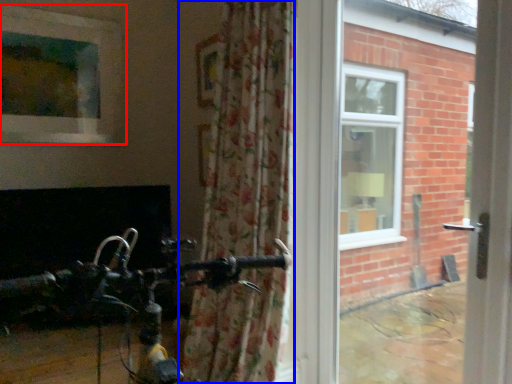
Question: Which of the following is the farthest to the observer, window (highlighted by a red box) or curtain (highlighted by a blue box)?

Choices:
 (A) window
 (B) curtain

Answer: (A)